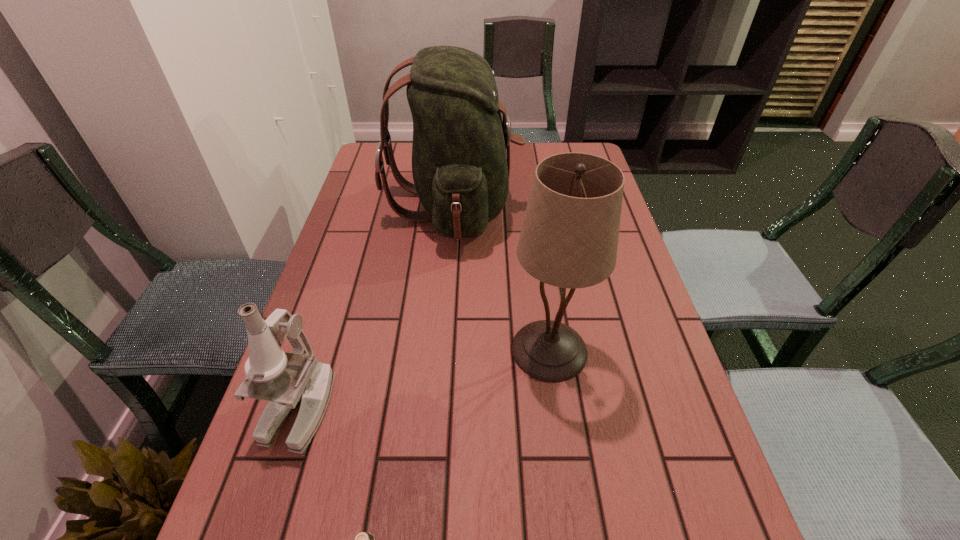
Locate an element on the screen. free space between the farthest object and the lampshade is located at coordinates (502, 278).

Identify the location of object that stands as the third closest to the backpack. (364, 539).

Find the location of a particular element. The height and width of the screenshot is (540, 960). object identified as the second closest to the backpack is located at coordinates (287, 380).